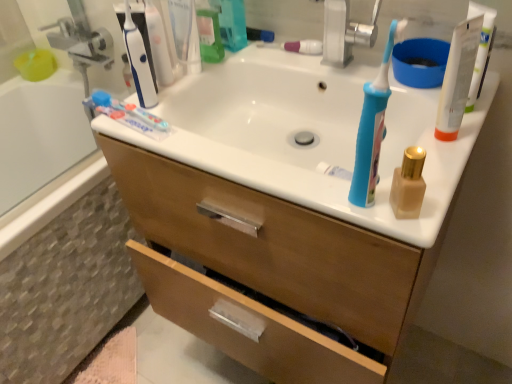
Locate an element on the screen. free space between matte gold bottle at right and white glossy toothpaste at upper left, positioned as the 1th toothpaste in front-to-back order is located at coordinates (261, 165).